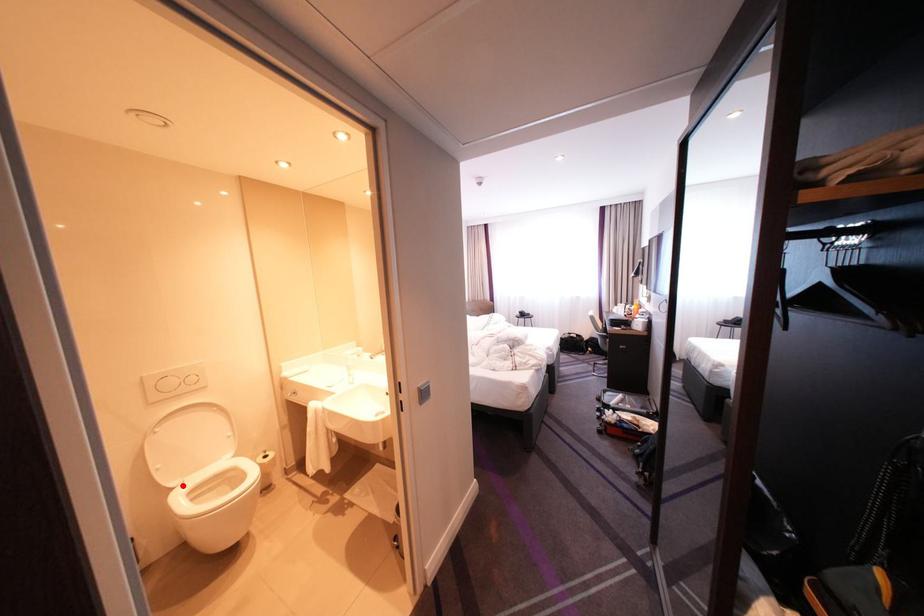
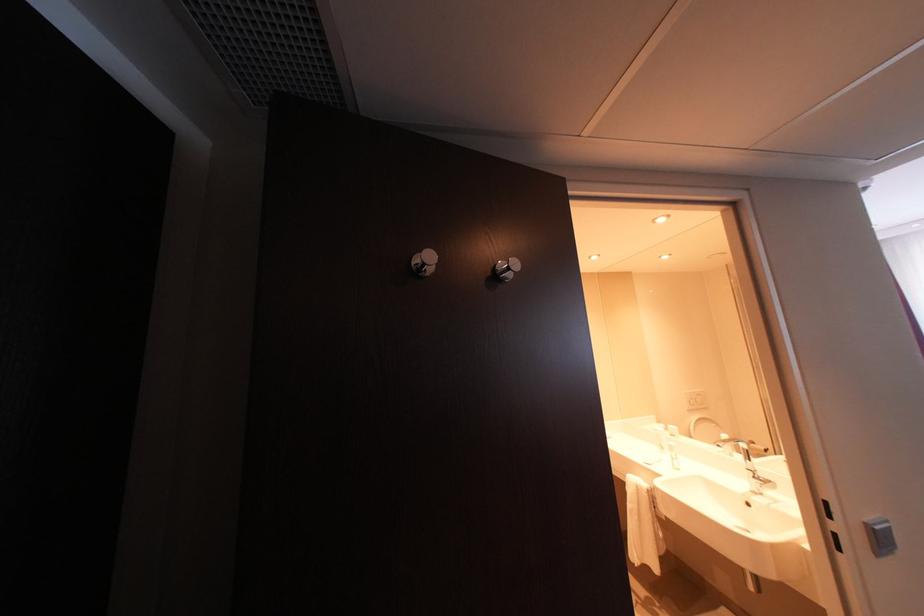
Question: I am providing you with two images of the same scene from different viewpoints. A red point is marked on the first image. At the location where the point appears in image 1, is it still visible in image 2?

Choices:
 (A) Yes
 (B) No

Answer: (B)